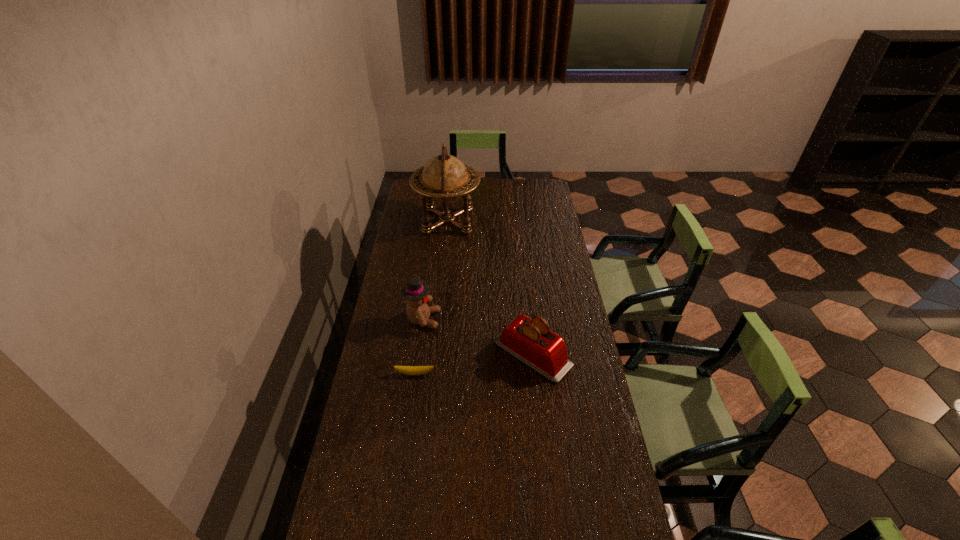
The width and height of the screenshot is (960, 540). I want to click on globe that is at the left edge, so click(x=445, y=178).

Locate an element on the screen. rag_doll located in the left edge section of the desktop is located at coordinates (415, 291).

Locate an element on the screen. The width and height of the screenshot is (960, 540). banana present at the left edge is located at coordinates (409, 370).

You are a GUI agent. You are given a task and a screenshot of the screen. Output one action in this format:
    pyautogui.click(x=<x>, y=<y>)
    Task: Click on the object positioned at the right edge
    The width and height of the screenshot is (960, 540).
    Given the screenshot: What is the action you would take?
    pyautogui.click(x=531, y=341)

I want to click on free region at the right edge of the desktop, so click(588, 509).

Locate an element on the screen. vacant space at the far right corner of the desktop is located at coordinates (533, 180).

Locate an element on the screen. This screenshot has width=960, height=540. vacant point located between the third shortest object and the third tallest object is located at coordinates (477, 336).

Locate an element on the screen. free space that is in between the third shortest object and the banana is located at coordinates (419, 347).

Locate an element on the screen. The image size is (960, 540). vacant space that's between the second shortest object and the shortest object is located at coordinates (473, 363).

At what (x,y) coordinates should I click in order to perform the action: click on unoccupied area between the tallest object and the rag_doll. Please return your answer as a coordinate pair (x, y). Image resolution: width=960 pixels, height=540 pixels. Looking at the image, I should click on (435, 271).